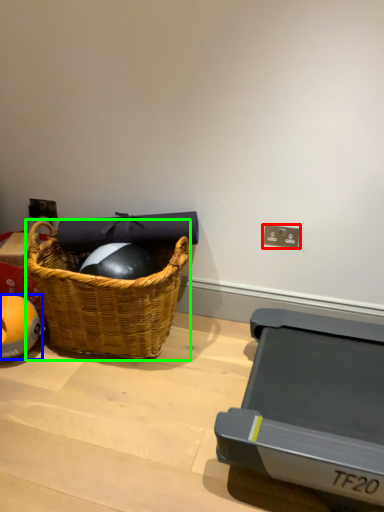
Question: Which object is the closest to the electric outlet (highlighted by a red box)? Choose among these: ball (highlighted by a blue box) or picnic basket (highlighted by a green box).

Choices:
 (A) ball
 (B) picnic basket

Answer: (B)